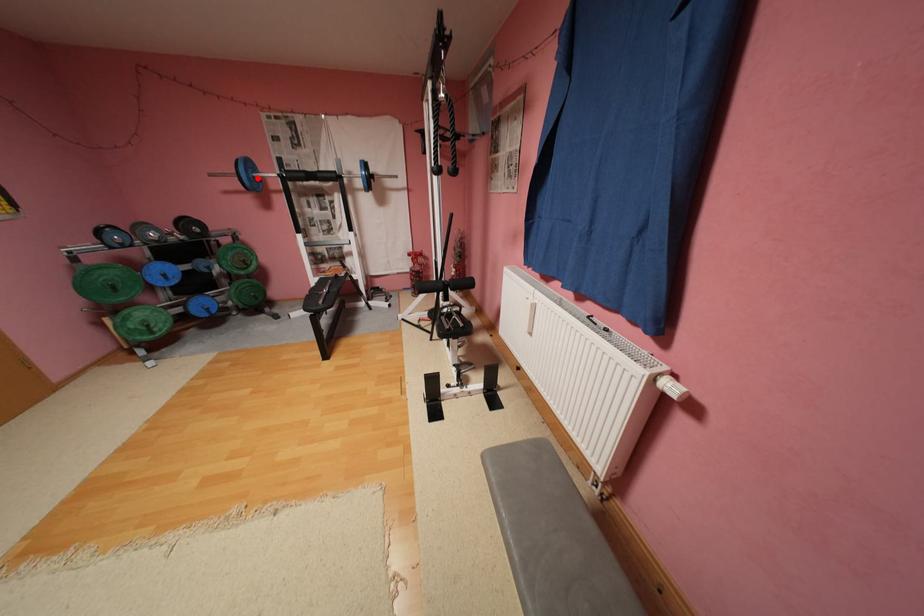
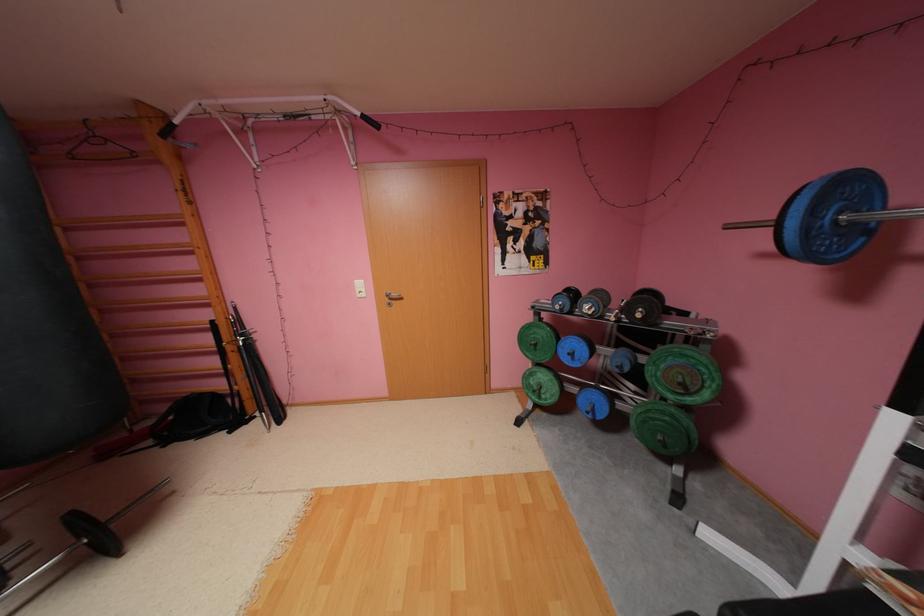
The point at the highlighted location is marked in the first image. Where is the corresponding point in the second image?

(816, 229)